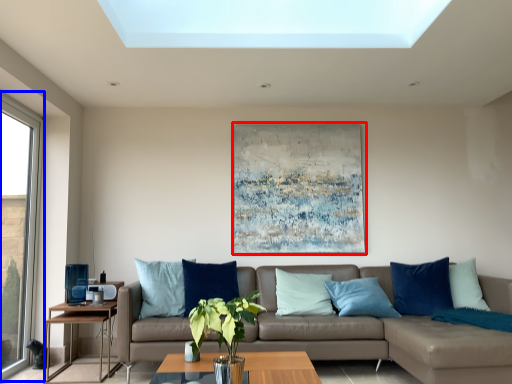
Question: Which object is closer to the camera taking this photo, picture frame (highlighted by a red box) or window (highlighted by a blue box)?

Choices:
 (A) picture frame
 (B) window

Answer: (B)